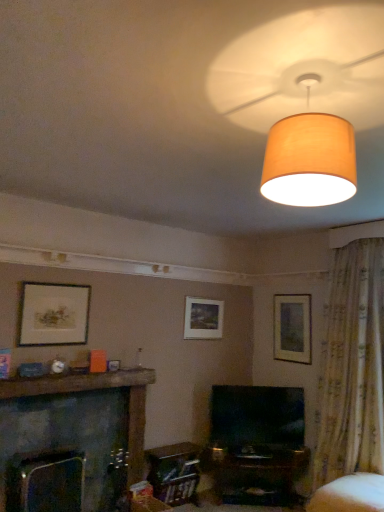
Measure the distance between floral fabric curtain at right and camera.

floral fabric curtain at right and camera are 11.75 feet apart from each other.

Identify the location of matte white picture frame at center, the second picture frame from the front. pyautogui.click(x=203, y=318).

Describe the element at coordinates (304, 69) in the screenshot. Image resolution: width=384 pixels, height=512 pixels. I see `matte beige lampshade at upper center` at that location.

The image size is (384, 512). Describe the element at coordinates (53, 314) in the screenshot. I see `matte gold picture frame at left, the 1th picture frame when ordered from front to back` at that location.

Find the location of a particular element. This screenshot has height=512, width=384. dark gray stone fireplace at lower left is located at coordinates (71, 440).

The height and width of the screenshot is (512, 384). What are the coordinates of `matte wooden picture frame at upper right, which appears as the first picture frame when viewed from the right` in the screenshot? It's located at (292, 328).

From the image's perspective, which is above, dark gray stone fireplace at lower left or matte beige lampshade at upper center?

matte beige lampshade at upper center appears higher in the image.

Is dark gray stone fireplace at lower left positioned far away from matte beige lampshade at upper center?

That's right, there is a large distance between dark gray stone fireplace at lower left and matte beige lampshade at upper center.

Is dark gray stone fireplace at lower left to the left or to the right of matte beige lampshade at upper center in the image?

In the image, dark gray stone fireplace at lower left appears on the left side of matte beige lampshade at upper center.

Could you measure the distance between dark gray stone fireplace at lower left and matte beige lampshade at upper center?

dark gray stone fireplace at lower left is 2.75 meters from matte beige lampshade at upper center.

Is dark gray stone fireplace at lower left at the left side of brown wooden mantle at lower left?

Indeed, dark gray stone fireplace at lower left is positioned on the left side of brown wooden mantle at lower left.

Is dark gray stone fireplace at lower left positioned far away from brown wooden mantle at lower left?

That's not correct — dark gray stone fireplace at lower left is a little close to brown wooden mantle at lower left.

From their relative heights in the image, would you say dark gray stone fireplace at lower left is taller or shorter than matte wooden picture frame at upper right, the 3th picture frame positioned from the left?

Clearly, dark gray stone fireplace at lower left is taller compared to matte wooden picture frame at upper right, the 3th picture frame positioned from the left.

Measure the distance from dark gray stone fireplace at lower left to matte wooden picture frame at upper right, the 3th picture frame positioned from the left.

dark gray stone fireplace at lower left and matte wooden picture frame at upper right, the 3th picture frame positioned from the left, are 2.10 meters apart from each other.

Is dark gray stone fireplace at lower left next to matte wooden picture frame at upper right, acting as the 1th picture frame starting from the back, and touching it?

No.

Can you tell me how much matte white picture frame at center, the 2th picture frame positioned from the right, and matte gold picture frame at left, acting as the first picture frame starting from the left, differ in facing direction?

The facing directions of matte white picture frame at center, the 2th picture frame positioned from the right, and matte gold picture frame at left, acting as the first picture frame starting from the left, are 0.0024 degrees apart.

From the image's perspective, which is below, matte white picture frame at center, the 2th picture frame positioned from the right, or matte gold picture frame at left, the 3th picture frame viewed from the back?

matte white picture frame at center, the 2th picture frame positioned from the right, is shown below in the image.

Looking at this image, considering the relative positions of matte white picture frame at center, which appears as the 2th picture frame when viewed from the back, and matte gold picture frame at left, acting as the first picture frame starting from the left, in the image provided, is matte white picture frame at center, which appears as the 2th picture frame when viewed from the back, in front of matte gold picture frame at left, acting as the first picture frame starting from the left,?

No, it is not.

Which is behind, point (192, 314) or point (46, 294)?

Point (192, 314)

Is matte wooden picture frame at upper right, which appears as the first picture frame when viewed from the right, at the left side of matte white picture frame at center, the 2th picture frame positioned from the right?

Incorrect, matte wooden picture frame at upper right, which appears as the first picture frame when viewed from the right, is not on the left side of matte white picture frame at center, the 2th picture frame positioned from the right.

Based on the photo, from a real-world perspective, does matte wooden picture frame at upper right, acting as the 1th picture frame starting from the back, sit lower than matte white picture frame at center, the second picture frame from the front?

→ Correct, in the physical world, matte wooden picture frame at upper right, acting as the 1th picture frame starting from the back, is lower than matte white picture frame at center, the second picture frame from the front.

Based on the photo, which object is wider, matte wooden picture frame at upper right, arranged as the third picture frame when viewed from the front, or matte white picture frame at center, the 2th picture frame positioned from the right?

matte white picture frame at center, the 2th picture frame positioned from the right.

Could you measure the distance between matte wooden picture frame at upper right, which appears as the first picture frame when viewed from the right, and matte white picture frame at center, which appears as the 2th picture frame when viewed from the back?

A distance of 31.78 inches exists between matte wooden picture frame at upper right, which appears as the first picture frame when viewed from the right, and matte white picture frame at center, which appears as the 2th picture frame when viewed from the back.

Can you confirm if matte beige lampshade at upper center is wider than matte gold picture frame at left, the 1th picture frame when ordered from front to back?

Yes.

Who is more distant, matte beige lampshade at upper center or matte gold picture frame at left, the third picture frame positioned from the right?

matte gold picture frame at left, the third picture frame positioned from the right, is further away from the camera.

Based on the photo, can you confirm if matte beige lampshade at upper center is bigger than matte gold picture frame at left, the third picture frame positioned from the right?

Indeed, matte beige lampshade at upper center has a larger size compared to matte gold picture frame at left, the third picture frame positioned from the right.

From a real-world perspective, who is located lower, matte beige lampshade at upper center or matte gold picture frame at left, the 1th picture frame when ordered from front to back?

matte gold picture frame at left, the 1th picture frame when ordered from front to back, from a real-world perspective.

Could you measure the distance between matte wooden picture frame at upper right, which appears as the first picture frame when viewed from the right, and dark gray stone fireplace at lower left?

The distance of matte wooden picture frame at upper right, which appears as the first picture frame when viewed from the right, from dark gray stone fireplace at lower left is 2.10 meters.

Where is `picture frame that is the 1st object located above the dark gray stone fireplace at lower left (from the image's perspective)`? This screenshot has width=384, height=512. picture frame that is the 1st object located above the dark gray stone fireplace at lower left (from the image's perspective) is located at coordinates (292, 328).

Is matte wooden picture frame at upper right, which appears as the first picture frame when viewed from the right, oriented away from dark gray stone fireplace at lower left?

matte wooden picture frame at upper right, which appears as the first picture frame when viewed from the right, does not have its back to dark gray stone fireplace at lower left.

Can you tell me how much matte wooden picture frame at upper right, which appears as the first picture frame when viewed from the right, and dark gray stone fireplace at lower left differ in facing direction?

There is a 91.2-degree angle between the facing directions of matte wooden picture frame at upper right, which appears as the first picture frame when viewed from the right, and dark gray stone fireplace at lower left.

Where is `fan in front of the dark gray stone fireplace at lower left`? fan in front of the dark gray stone fireplace at lower left is located at coordinates (304, 69).

Image resolution: width=384 pixels, height=512 pixels. Find the location of `mantle behind the dark gray stone fireplace at lower left`. mantle behind the dark gray stone fireplace at lower left is located at coordinates (75, 383).

Consider the image. Looking at the image, which one is located closer to matte gold picture frame at left, the third picture frame positioned from the right, matte white picture frame at center, the 2th picture frame positioned from the right, or brown wooden mantle at lower left?

brown wooden mantle at lower left.

Considering their positions, is matte white picture frame at center, the second picture frame from the front, positioned further to dark gray stone fireplace at lower left than white fabric swivel chair at lower right?

Among the two, white fabric swivel chair at lower right is located further to dark gray stone fireplace at lower left.

Considering their positions, is white fabric swivel chair at lower right positioned closer to dark gray stone fireplace at lower left than matte beige lampshade at upper center?

white fabric swivel chair at lower right lies closer to dark gray stone fireplace at lower left than the other object.

Looking at the image, which one is located further to matte beige lampshade at upper center, matte white picture frame at center, which appears as the 2th picture frame when viewed from the back, or white fabric swivel chair at lower right?

The object further to matte beige lampshade at upper center is matte white picture frame at center, which appears as the 2th picture frame when viewed from the back.

When comparing their distances from floral fabric curtain at right, does white fabric swivel chair at lower right or matte beige lampshade at upper center seem closer?

The object closer to floral fabric curtain at right is white fabric swivel chair at lower right.

Estimate the real-world distances between objects in this image. Which object is closer to matte beige lampshade at upper center, matte wooden picture frame at upper right, arranged as the third picture frame when viewed from the front, or floral fabric curtain at right?

floral fabric curtain at right is positioned closer to the anchor matte beige lampshade at upper center.

Looking at the image, which one is located closer to matte wooden picture frame at upper right, which appears as the first picture frame when viewed from the right, matte gold picture frame at left, acting as the first picture frame starting from the left, or floral fabric curtain at right?

floral fabric curtain at right is closer to matte wooden picture frame at upper right, which appears as the first picture frame when viewed from the right.

When comparing their distances from matte gold picture frame at left, acting as the first picture frame starting from the left, does matte wooden picture frame at upper right, acting as the 1th picture frame starting from the back, or dark gray stone fireplace at lower left seem further?

matte wooden picture frame at upper right, acting as the 1th picture frame starting from the back, is positioned further to the anchor matte gold picture frame at left, acting as the first picture frame starting from the left.

The image size is (384, 512). Find the location of `mantle between dark gray stone fireplace at lower left and matte white picture frame at center, which appears as the 2th picture frame when viewed from the back, along the z-axis`. mantle between dark gray stone fireplace at lower left and matte white picture frame at center, which appears as the 2th picture frame when viewed from the back, along the z-axis is located at coordinates (75, 383).

What are the coordinates of `television between dark gray stone fireplace at lower left and white fabric swivel chair at lower right` in the screenshot? It's located at (257, 416).

Image resolution: width=384 pixels, height=512 pixels. In order to click on swivel chair situated between dark gray stone fireplace at lower left and floral fabric curtain at right from left to right in this screenshot , I will do `click(350, 494)`.

The width and height of the screenshot is (384, 512). Identify the location of picture frame located between brown wooden mantle at lower left and matte white picture frame at center, which appears as the 2th picture frame when viewed from the back, in the depth direction. (53, 314).